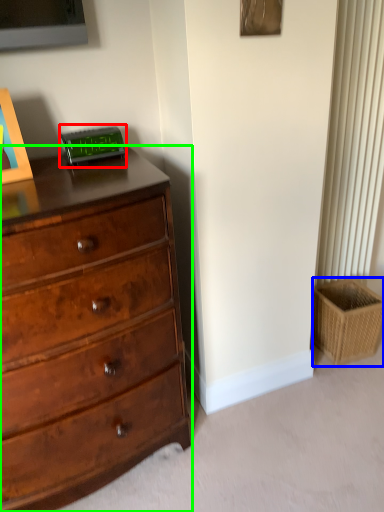
Question: Which object is positioned farthest from alarm clock (highlighted by a red box)? Select from basket (highlighted by a blue box) and chest of drawers (highlighted by a green box).

Choices:
 (A) basket
 (B) chest of drawers

Answer: (A)